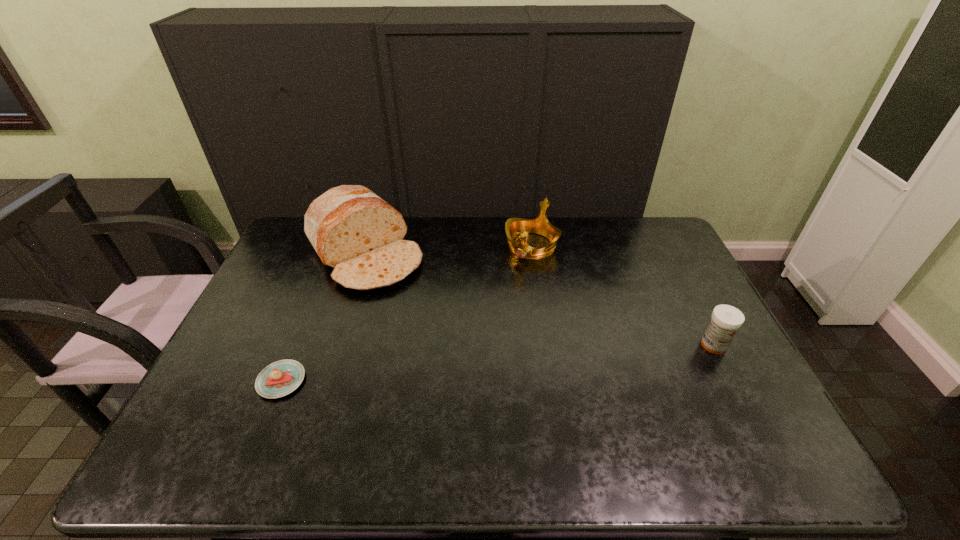
This screenshot has width=960, height=540. What are the coordinates of `the shortest object` in the screenshot? It's located at (282, 377).

The height and width of the screenshot is (540, 960). What are the coordinates of `the nearest object` in the screenshot? It's located at tap(282, 377).

Locate an element on the screen. The height and width of the screenshot is (540, 960). medicine is located at coordinates (725, 321).

I want to click on the rightmost object, so click(x=725, y=321).

Locate an element on the screen. This screenshot has height=540, width=960. the third object from left to right is located at coordinates (515, 227).

Locate an element on the screen. bread is located at coordinates (355, 232).

Find the location of a particular element. This screenshot has width=960, height=540. free point located on the right of the nearest object is located at coordinates (363, 381).

Locate an element on the screen. The image size is (960, 540). vacant region located 0.140m on the left of the rightmost object is located at coordinates (649, 345).

This screenshot has height=540, width=960. I want to click on vacant region located at the front emblem of the tiara, so click(483, 319).

Locate an element on the screen. The height and width of the screenshot is (540, 960). vacant region located 0.100m at the front emblem of the tiara is located at coordinates (509, 281).